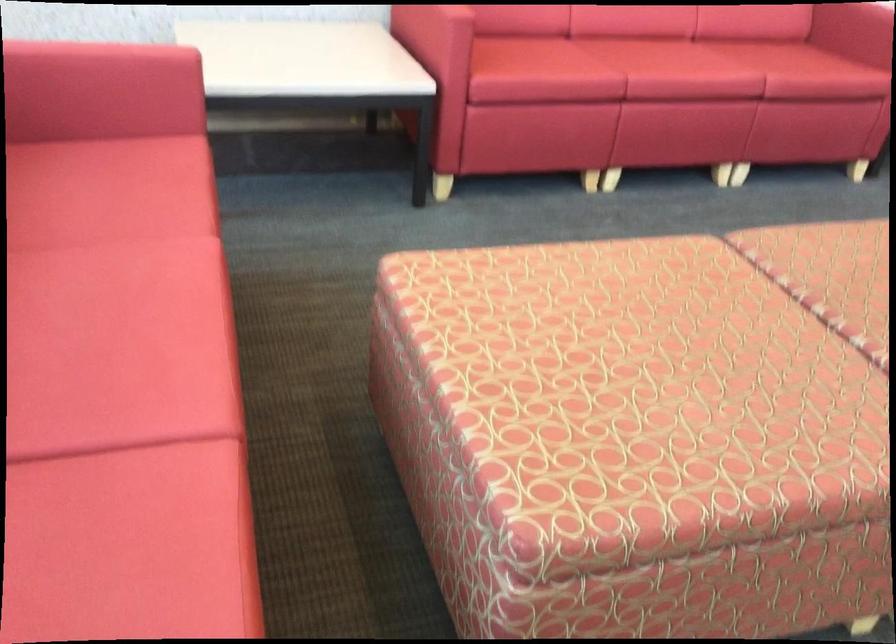
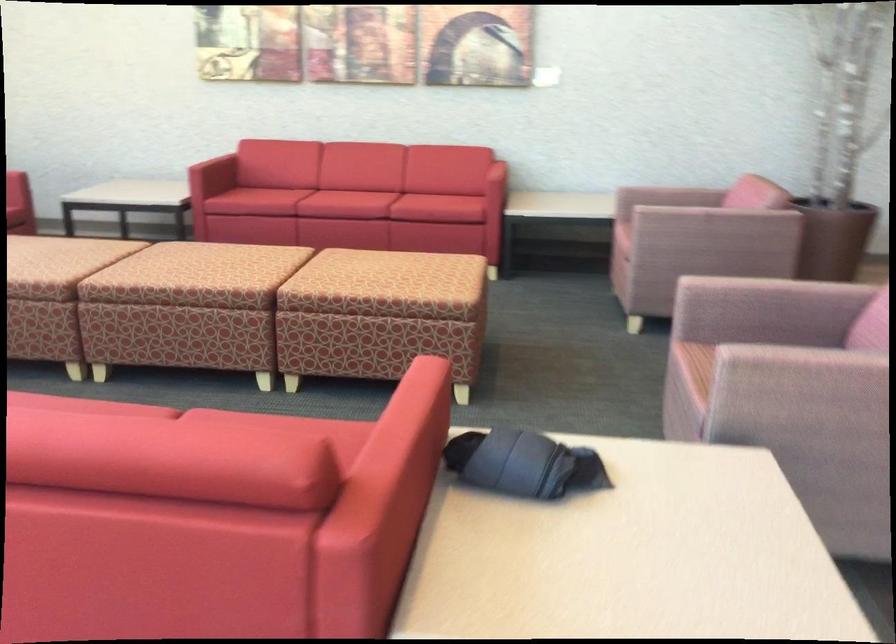
Find the pixel in the second image that matches (x=589, y=111) in the first image.

(265, 200)